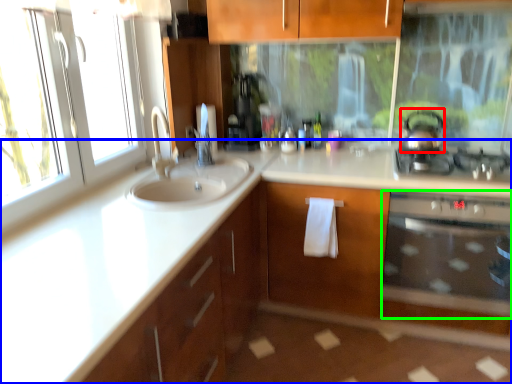
Question: Estimate the real-world distances between objects in this image. Which object is closer to tea pot (highlighted by a red box), countertop (highlighted by a blue box) or oven (highlighted by a green box)?

Choices:
 (A) countertop
 (B) oven

Answer: (B)